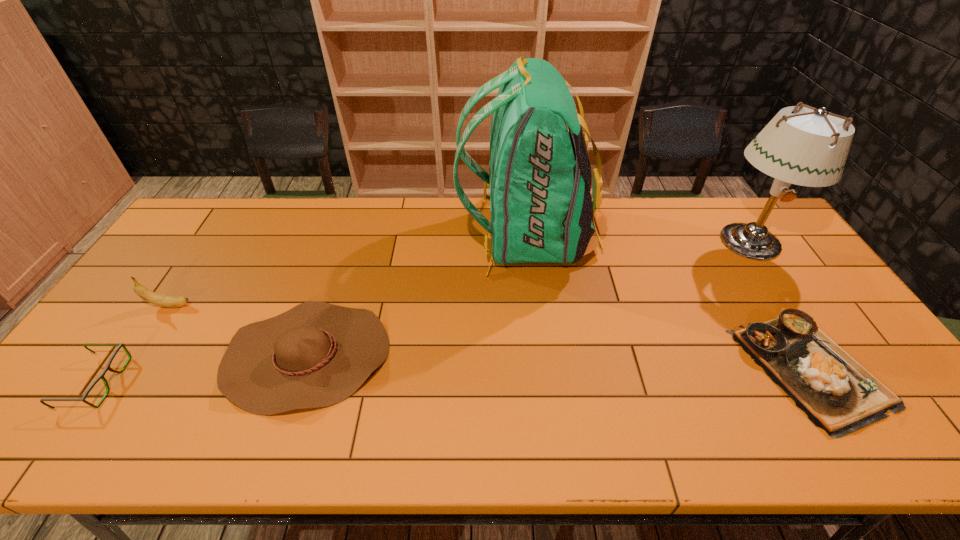
The height and width of the screenshot is (540, 960). Find the location of `vacant space located on the back of the tallest object`. vacant space located on the back of the tallest object is located at coordinates (431, 236).

Locate an element on the screen. This screenshot has height=540, width=960. vacant space situated on the lampshade of the lampshade is located at coordinates (799, 318).

At what (x,y) coordinates should I click in order to perform the action: click on free space located at the start of the peel on the third tallest object. Please return your answer as a coordinate pair (x, y). The height and width of the screenshot is (540, 960). Looking at the image, I should click on (302, 306).

I want to click on vacant space located 0.090m on the right of the fourth tallest object, so click(423, 356).

Find the location of a particular element. The height and width of the screenshot is (540, 960). vacant space located 0.290m on the left of the platter is located at coordinates (627, 366).

Find the location of `vacant space located on the lens of the spectacles`. vacant space located on the lens of the spectacles is located at coordinates (174, 382).

Where is `backpack located at the far edge`? This screenshot has height=540, width=960. backpack located at the far edge is located at coordinates (541, 209).

Where is `lampshade that is at the far edge`? The image size is (960, 540). lampshade that is at the far edge is located at coordinates (809, 148).

This screenshot has height=540, width=960. What are the coordinates of `cowboy hat present at the near edge` in the screenshot? It's located at (317, 354).

The image size is (960, 540). In order to click on platter that is at the near edge in this screenshot , I will do click(x=837, y=394).